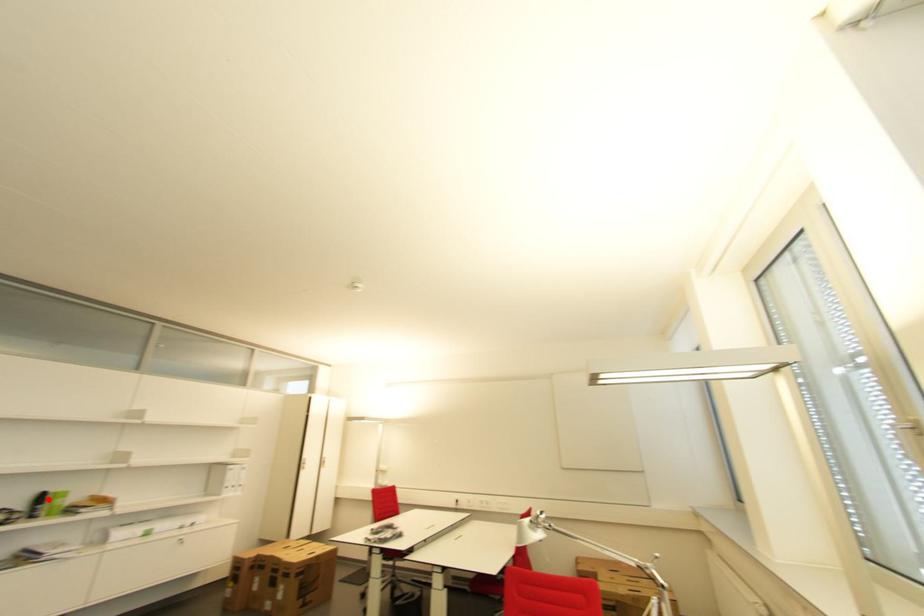
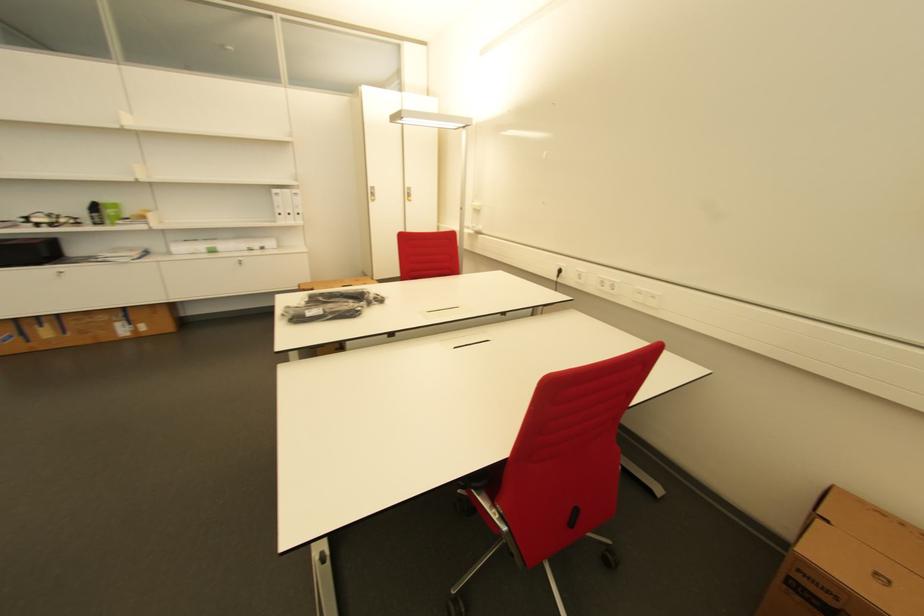
Question: I am providing you with two images of the same scene from different viewpoints. A red point is shown in image1. For the corresponding object point in image2, is it positioned nearer or farther from the camera?

Choices:
 (A) Nearer
 (B) Farther

Answer: (B)